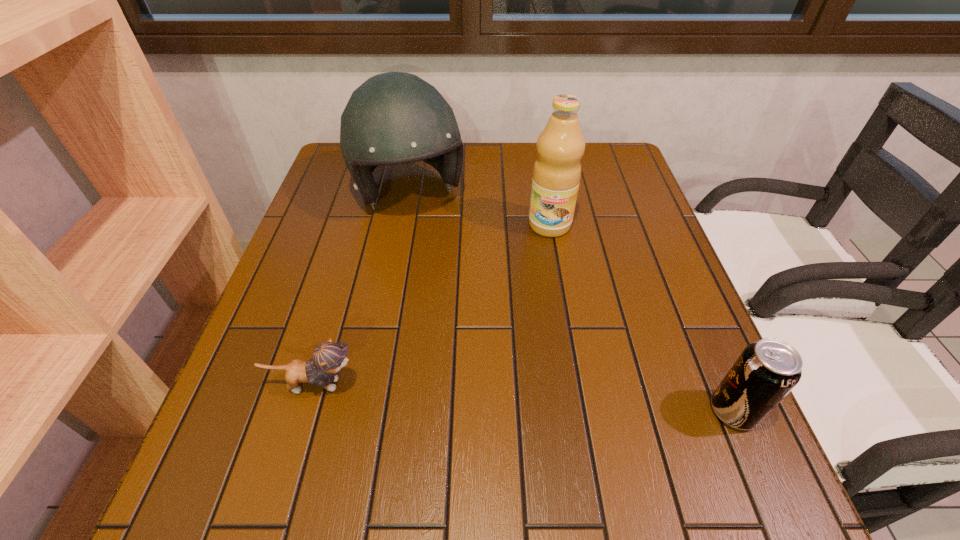
The image size is (960, 540). Identify the location of vacant space on the desktop that is between the kitten and the rightmost object and is positioned at the face opening of the football helmet. (501, 396).

This screenshot has width=960, height=540. I want to click on free space on the desktop that is between the kitten and the rightmost object and is positioned on the label of the second object from right to left, so click(x=521, y=397).